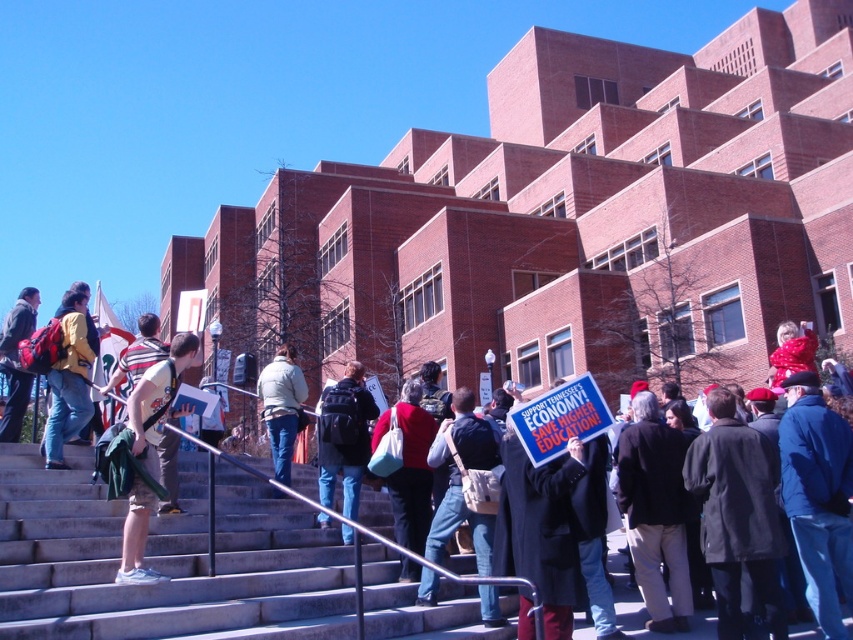
Between gray concrete stairs at center and matte black backpack at center, which one is positioned lower?

gray concrete stairs at center is lower down.

Does gray concrete stairs at center have a lesser height compared to matte black backpack at center?

Correct, gray concrete stairs at center is not as tall as matte black backpack at center.

You are a GUI agent. You are given a task and a screenshot of the screen. Output one action in this format:
    pyautogui.click(x=<x>, y=<y>)
    Task: Click on the gray concrete stairs at center
    The image size is (853, 640).
    Given the screenshot: What is the action you would take?
    pyautogui.click(x=164, y=561)

I want to click on gray concrete stairs at center, so click(164, 561).

Is matte yellow jacket at center in front of matte black backpack at left?

Yes, matte yellow jacket at center is closer to the viewer.

Who is positioned more to the left, matte yellow jacket at center or matte black backpack at left?

matte black backpack at left

You are a GUI agent. You are given a task and a screenshot of the screen. Output one action in this format:
    pyautogui.click(x=<x>, y=<y>)
    Task: Click on the matte yellow jacket at center
    This screenshot has width=853, height=640.
    Given the screenshot: What is the action you would take?
    pyautogui.click(x=68, y=378)

Which is more to the right, khaki shorts at left or matte black backpack at center?

From the viewer's perspective, matte black backpack at center appears more on the right side.

The height and width of the screenshot is (640, 853). Identify the location of khaki shorts at left. (157, 397).